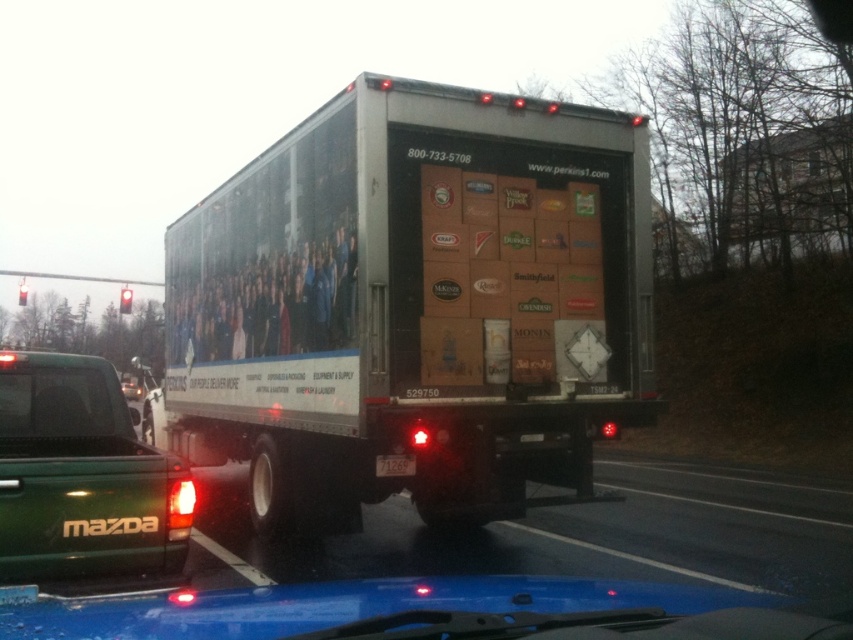
Does point (251, 256) lie behind point (408, 467)?

Yes, it is.

Which is in front, point (357, 216) or point (381, 458)?

Point (357, 216) is in front.

Is point (352, 381) positioned in front of point (389, 467)?

Yes, it is.

At what (x,y) coordinates should I click in order to perform the action: click on silver metallic trailer truck at center. Please return your answer as a coordinate pair (x, y). Looking at the image, I should click on (415, 305).

Consider the image. Is silver metallic trailer truck at center below green matte truck at lower left?

Incorrect, silver metallic trailer truck at center is not positioned below green matte truck at lower left.

From the picture: Does silver metallic trailer truck at center have a greater width compared to green matte truck at lower left?

Yes.

Is point (531, 355) farther from camera compared to point (53, 374)?

Yes, point (531, 355) is behind point (53, 374).

Locate an element on the screen. Image resolution: width=853 pixels, height=640 pixels. silver metallic trailer truck at center is located at coordinates (415, 305).

Identify the location of transparent glass windshield at lower left. (61, 397).

Which is more to the right, transparent glass windshield at lower left or black plastic license plate at center?

From the viewer's perspective, black plastic license plate at center appears more on the right side.

Who is more forward, (74,380) or (381,472)?

Point (74,380) is in front.

Image resolution: width=853 pixels, height=640 pixels. Identify the location of transparent glass windshield at lower left. (61, 397).